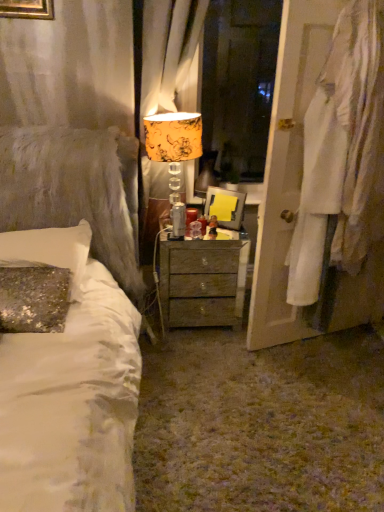
Question: Considering the relative sizes of yellow floral fabric lampshade at center and matte plastic picture frame at center in the image provided, is yellow floral fabric lampshade at center taller than matte plastic picture frame at center?

Choices:
 (A) yes
 (B) no

Answer: (A)

Question: Is yellow floral fabric lampshade at center closer to camera compared to matte plastic picture frame at center?

Choices:
 (A) no
 (B) yes

Answer: (B)

Question: Is yellow floral fabric lampshade at center smaller than matte plastic picture frame at center?

Choices:
 (A) no
 (B) yes

Answer: (A)

Question: Is yellow floral fabric lampshade at center outside of matte plastic picture frame at center?

Choices:
 (A) no
 (B) yes

Answer: (B)

Question: Is yellow floral fabric lampshade at center at the left side of matte plastic picture frame at center?

Choices:
 (A) yes
 (B) no

Answer: (A)

Question: Could you tell me if yellow floral fabric lampshade at center is turned towards matte plastic picture frame at center?

Choices:
 (A) no
 (B) yes

Answer: (A)

Question: Is white fabric at right positioned with its back to wooden nightstand at center?

Choices:
 (A) no
 (B) yes

Answer: (A)

Question: From the image's perspective, is white fabric at right over wooden nightstand at center?

Choices:
 (A) yes
 (B) no

Answer: (A)

Question: Considering the relative sizes of white fabric at right and wooden nightstand at center in the image provided, is white fabric at right wider than wooden nightstand at center?

Choices:
 (A) yes
 (B) no

Answer: (B)

Question: Does white fabric at right have a lesser width compared to wooden nightstand at center?

Choices:
 (A) yes
 (B) no

Answer: (A)

Question: Is white fabric at right taller than wooden nightstand at center?

Choices:
 (A) no
 (B) yes

Answer: (B)

Question: Is white fabric at right next to wooden nightstand at center?

Choices:
 (A) no
 (B) yes

Answer: (A)

Question: From a real-world perspective, is sequined fabric pillow at left physically below orange floral fabric curtain at upper center?

Choices:
 (A) yes
 (B) no

Answer: (A)